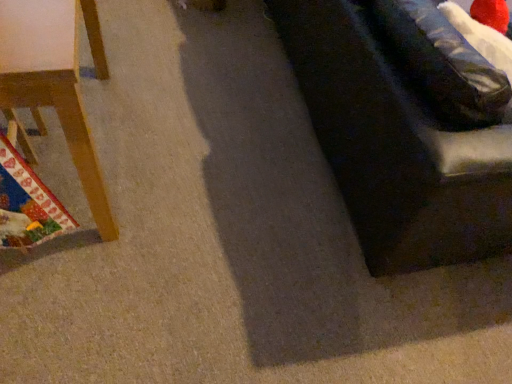
Question: From the image's perspective, does wooden chair at left appear higher than dark fabric couch at right?

Choices:
 (A) no
 (B) yes

Answer: (A)

Question: Is wooden chair at left beside dark fabric couch at right?

Choices:
 (A) no
 (B) yes

Answer: (A)

Question: Does wooden chair at left have a greater height compared to dark fabric couch at right?

Choices:
 (A) no
 (B) yes

Answer: (A)

Question: Is dark fabric couch at right a part of wooden chair at left?

Choices:
 (A) no
 (B) yes

Answer: (A)

Question: From the image's perspective, would you say wooden chair at left is shown under dark fabric couch at right?

Choices:
 (A) yes
 (B) no

Answer: (A)

Question: Is wooden chair at left far away from dark fabric couch at right?

Choices:
 (A) no
 (B) yes

Answer: (A)

Question: Is dark fabric couch at right taller than wooden chair at left?

Choices:
 (A) yes
 (B) no

Answer: (A)

Question: Considering the relative positions of dark fabric couch at right and wooden chair at left in the image provided, is dark fabric couch at right to the left of wooden chair at left from the viewer's perspective?

Choices:
 (A) no
 (B) yes

Answer: (A)

Question: Is there a large distance between dark fabric couch at right and wooden chair at left?

Choices:
 (A) yes
 (B) no

Answer: (B)

Question: From a real-world perspective, is dark fabric couch at right positioned over wooden chair at left based on gravity?

Choices:
 (A) yes
 (B) no

Answer: (A)

Question: Is dark fabric couch at right outside of wooden chair at left?

Choices:
 (A) no
 (B) yes

Answer: (B)

Question: Is dark fabric couch at right to the right of wooden chair at left from the viewer's perspective?

Choices:
 (A) yes
 (B) no

Answer: (A)

Question: From the image's perspective, is wooden chair at left above or below dark fabric couch at right?

Choices:
 (A) above
 (B) below

Answer: (B)